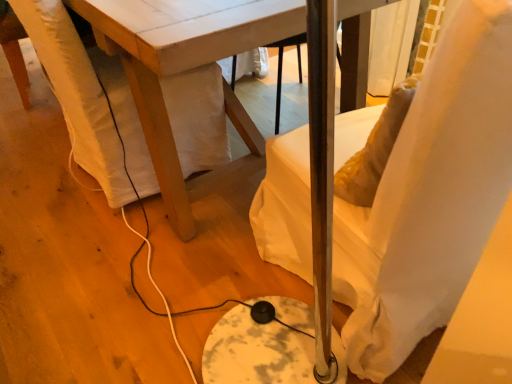
Question: Is point (97, 112) closer or farther from the camera than point (344, 100)?

Choices:
 (A) closer
 (B) farther

Answer: (A)

Question: From a real-world perspective, is white fabric swivel chair at lower left physically located above or below white wood table at center?

Choices:
 (A) above
 (B) below

Answer: (B)

Question: Estimate the real-world distances between objects in this image. Which object is farther from the white wood table at center?

Choices:
 (A) white fabric swivel chair at lower left
 (B) white fabric chair at right

Answer: (B)

Question: Estimate the real-world distances between objects in this image. Which object is farther from the white fabric swivel chair at lower left?

Choices:
 (A) white wood table at center
 (B) white fabric chair at right

Answer: (B)